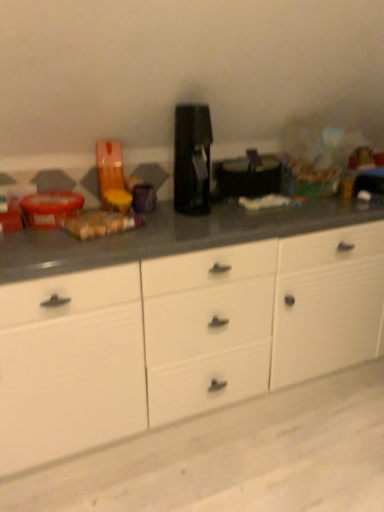
The image size is (384, 512). In order to click on black plastic coffee machine at center in this screenshot , I will do `click(192, 159)`.

What do you see at coordinates (192, 159) in the screenshot? I see `black plastic coffee machine at center` at bounding box center [192, 159].

In order to face black plastic coffee machine at center, should I rotate leftwards or rightwards?

Turn left by 0.055 degrees to look at black plastic coffee machine at center.

This screenshot has width=384, height=512. Describe the element at coordinates (180, 337) in the screenshot. I see `white matte cabinet at center` at that location.

Find the location of `white matte cabinet at center`. white matte cabinet at center is located at coordinates (180, 337).

The height and width of the screenshot is (512, 384). I want to click on black plastic coffee machine at center, so click(192, 159).

Does black plastic coffee machine at center appear on the left side of white matte cabinet at center?

Correct, you'll find black plastic coffee machine at center to the left of white matte cabinet at center.

Is black plastic coffee machine at center positioned in front of white matte cabinet at center?

No, black plastic coffee machine at center is further to the viewer.

Considering the points (196, 169) and (123, 266), which point is in front, point (196, 169) or point (123, 266)?

The point (123, 266) is more forward.

From the image's perspective, between black plastic coffee machine at center and white matte cabinet at center, who is located below?

white matte cabinet at center.

From a real-world perspective, which is physically below, black plastic coffee machine at center or white matte cabinet at center?

white matte cabinet at center is physically lower.

From the picture: Which of these two, black plastic coffee machine at center or white matte cabinet at center, is thinner?

black plastic coffee machine at center is thinner.

In terms of height, does black plastic coffee machine at center look taller or shorter compared to white matte cabinet at center?

black plastic coffee machine at center is shorter than white matte cabinet at center.

Considering the relative sizes of black plastic coffee machine at center and white matte cabinet at center in the image provided, is black plastic coffee machine at center smaller than white matte cabinet at center?

Correct, black plastic coffee machine at center occupies less space than white matte cabinet at center.

Is black plastic coffee machine at center completely or partially outside of white matte cabinet at center?

black plastic coffee machine at center is positioned outside white matte cabinet at center.

Would you say black plastic coffee machine at center is a long distance from white matte cabinet at center?

black plastic coffee machine at center is actually quite close to white matte cabinet at center.

Could you tell me if black plastic coffee machine at center is facing white matte cabinet at center?

No, black plastic coffee machine at center does not turn towards white matte cabinet at center.

What's the angular difference between black plastic coffee machine at center and white matte cabinet at center's facing directions?

black plastic coffee machine at center and white matte cabinet at center are facing 0.709 degrees away from each other.

How far apart are black plastic coffee machine at center and white matte cabinet at center?

22.25 inches.

Find the location of a particular element. This screenshot has width=384, height=512. coffee machine on the left of white matte cabinet at center is located at coordinates (192, 159).

Which is more to the left, white matte cabinet at center or black plastic coffee machine at center?

Positioned to the left is black plastic coffee machine at center.

Between white matte cabinet at center and black plastic coffee machine at center, which one is positioned in front?

white matte cabinet at center is closer to the camera.

Considering the positions of points (313, 368) and (199, 110), is point (313, 368) closer to camera compared to point (199, 110)?

No, (313, 368) is behind (199, 110).

From the image's perspective, is white matte cabinet at center positioned above or below black plastic coffee machine at center?

Based on their image positions, white matte cabinet at center is located beneath black plastic coffee machine at center.

In the scene shown: From a real-world perspective, which is physically below, white matte cabinet at center or black plastic coffee machine at center?

From a 3D spatial view, white matte cabinet at center is below.

In the scene shown: Considering the sizes of objects white matte cabinet at center and black plastic coffee machine at center in the image provided, who is wider, white matte cabinet at center or black plastic coffee machine at center?

With larger width is white matte cabinet at center.

From their relative heights in the image, would you say white matte cabinet at center is taller or shorter than black plastic coffee machine at center?

white matte cabinet at center is taller than black plastic coffee machine at center.

Which of these two, white matte cabinet at center or black plastic coffee machine at center, is bigger?

white matte cabinet at center is bigger.

Is white matte cabinet at center located outside black plastic coffee machine at center?

white matte cabinet at center lies outside black plastic coffee machine at center's area.

Is white matte cabinet at center not near black plastic coffee machine at center?

That's not correct — white matte cabinet at center is a little close to black plastic coffee machine at center.

Is white matte cabinet at center facing towards black plastic coffee machine at center?

No, white matte cabinet at center is not aimed at black plastic coffee machine at center.

You are a GUI agent. You are given a task and a screenshot of the screen. Output one action in this format:
    pyautogui.click(x=<x>, y=<y>)
    Task: Click on the coffee machine on the left of white matte cabinet at center
    The image size is (384, 512).
    Given the screenshot: What is the action you would take?
    pyautogui.click(x=192, y=159)

Where is `cabinetry in front of the black plastic coffee machine at center`? This screenshot has height=512, width=384. cabinetry in front of the black plastic coffee machine at center is located at coordinates (180, 337).

Image resolution: width=384 pixels, height=512 pixels. Find the location of `cabinetry on the right of black plastic coffee machine at center`. cabinetry on the right of black plastic coffee machine at center is located at coordinates (180, 337).